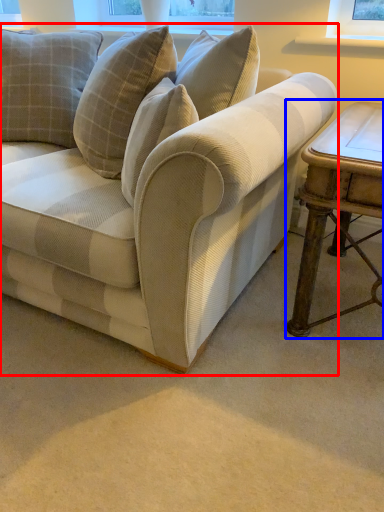
Question: Which object is closer to the camera taking this photo, studio couch (highlighted by a red box) or table (highlighted by a blue box)?

Choices:
 (A) studio couch
 (B) table

Answer: (A)